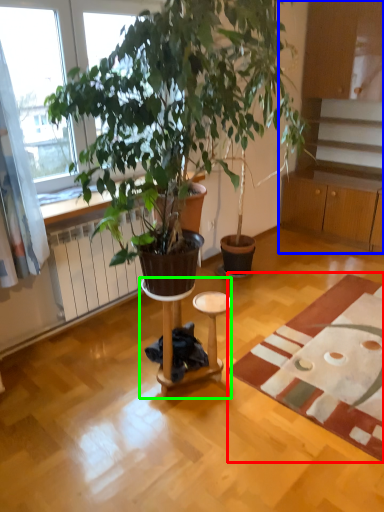
Question: Based on their relative distances, which object is nearer to mat (highlighted by a red box)? Choose from cabinetry (highlighted by a blue box) and side table (highlighted by a green box).

Choices:
 (A) cabinetry
 (B) side table

Answer: (B)